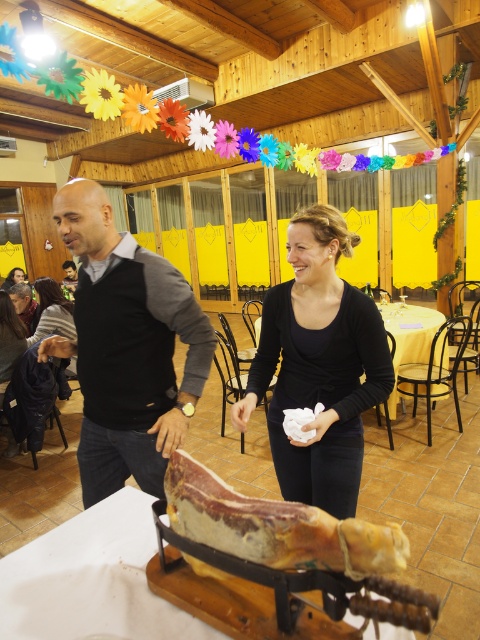
Which is more to the left, black matte dress at center or dark brown hair at lower left?

dark brown hair at lower left is more to the left.

Identify the location of black matte dress at center. This screenshot has height=640, width=480. (319, 364).

Identify the location of black matte dress at center. The height and width of the screenshot is (640, 480). (319, 364).

Who is higher up, dark gray sweater at left or dark brown hair at lower left?

dark brown hair at lower left is higher up.

Who is positioned more to the left, dark gray sweater at left or dark brown hair at lower left?

Positioned to the left is dark brown hair at lower left.

Identify the location of dark gray sweater at left. The image size is (480, 640). (127, 348).

This screenshot has width=480, height=640. Identify the location of dark gray sweater at left. (127, 348).

Looking at this image, is raw cured meat at center closer to the viewer compared to dark brown leather jacket at lower left?

Yes.

Looking at this image, does raw cured meat at center have a greater height compared to dark brown leather jacket at lower left?

No, raw cured meat at center is not taller than dark brown leather jacket at lower left.

Locate an element on the screen. This screenshot has width=480, height=640. raw cured meat at center is located at coordinates (276, 525).